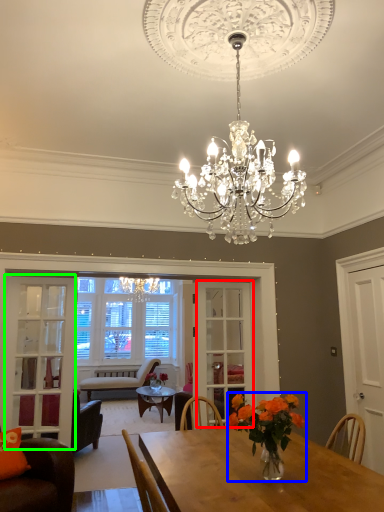
Question: Based on their relative distances, which object is farther from glass door (highlighted by a red box)? Choose from floral arrangement (highlighted by a blue box) and glass door (highlighted by a green box).

Choices:
 (A) floral arrangement
 (B) glass door

Answer: (A)